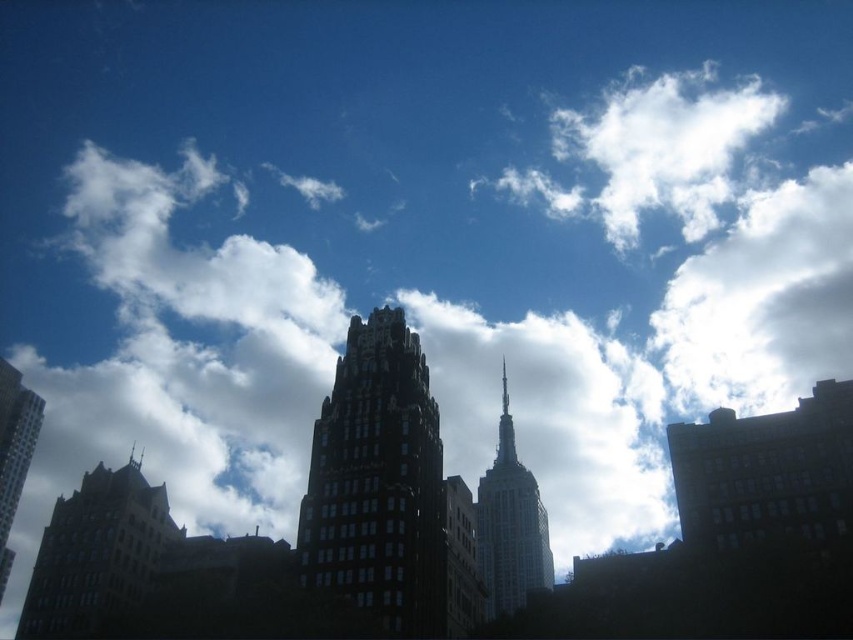
Does white fluffy cloud at upper center have a smaller size compared to dark gray stone tower at lower left?

→ Actually, white fluffy cloud at upper center might be larger than dark gray stone tower at lower left.

In the scene shown: Can you confirm if white fluffy cloud at upper center is bigger than dark gray stone tower at lower left?

Yes.

Does point (677, 156) come closer to viewer compared to point (84, 593)?

No.

This screenshot has height=640, width=853. I want to click on white fluffy cloud at upper center, so click(x=653, y=150).

You are a GUI agent. You are given a task and a screenshot of the screen. Output one action in this format:
    pyautogui.click(x=<x>, y=<y>)
    Task: Click on the dark gray stone tower at lower left
    The height and width of the screenshot is (640, 853).
    Given the screenshot: What is the action you would take?
    pyautogui.click(x=96, y=554)

Does dark gray stone tower at lower left have a lesser height compared to white glass tower at center?

Correct, dark gray stone tower at lower left is not as tall as white glass tower at center.

Find the location of a particular element. The image size is (853, 640). dark gray stone tower at lower left is located at coordinates point(96,554).

Can you confirm if white glass tower at center is smaller than dark glass skyscraper at left?

No, white glass tower at center is not smaller than dark glass skyscraper at left.

Find the location of `white glass tower at center`. white glass tower at center is located at coordinates click(x=509, y=525).